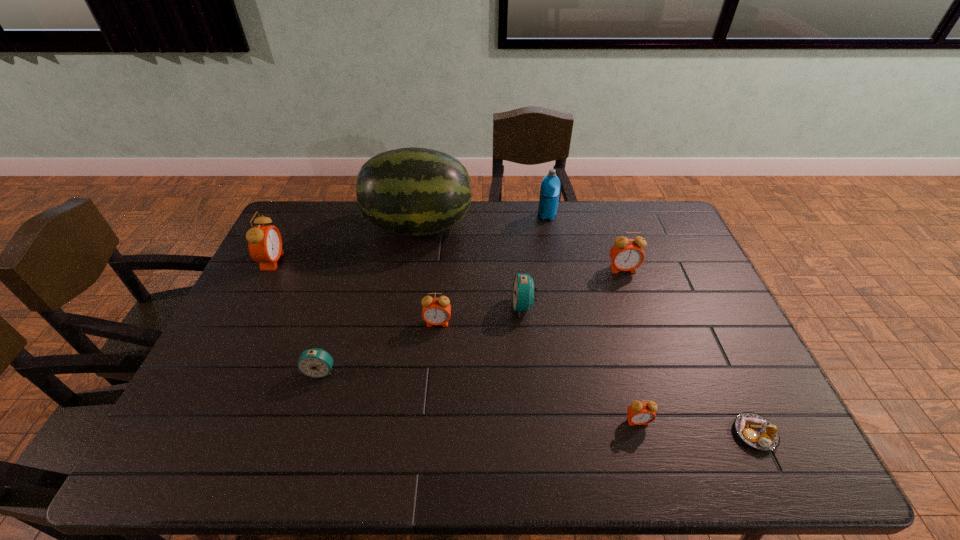
Identify the location of the tallest object. Image resolution: width=960 pixels, height=540 pixels. (412, 191).

Identify the location of green watermelon. (412, 191).

Where is `the fourth object from right to left`? This screenshot has height=540, width=960. the fourth object from right to left is located at coordinates (550, 186).

The height and width of the screenshot is (540, 960). I want to click on the tallest alarm clock, so click(x=265, y=243).

At what (x,y) coordinates should I click in order to perform the action: click on the leftmost alarm clock. Please return your answer as a coordinate pair (x, y). This screenshot has height=540, width=960. Looking at the image, I should click on (265, 243).

The image size is (960, 540). I want to click on the fourth tallest object, so click(x=626, y=254).

Locate an element on the screen. the fifth shortest alarm clock is located at coordinates (626, 254).

You are a GUI agent. You are given a task and a screenshot of the screen. Output one action in this format:
    pyautogui.click(x=<x>, y=<y>)
    Task: Click on the right blue alarm clock
    This screenshot has width=960, height=540.
    Given the screenshot: What is the action you would take?
    pyautogui.click(x=523, y=293)

Identify the location of the bigger blue alarm clock. This screenshot has width=960, height=540. (523, 293).

Locate an element on the screen. This screenshot has width=960, height=540. the fourth alarm clock from right to left is located at coordinates (436, 311).